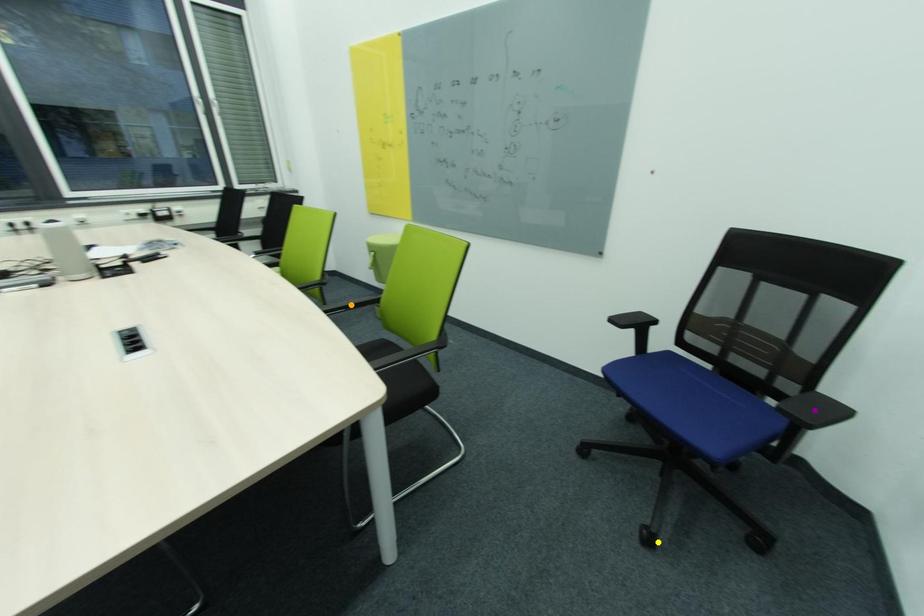
From the picture: Order these from nearest to farthest:
1. orange point
2. yellow point
3. purple point

purple point < yellow point < orange point